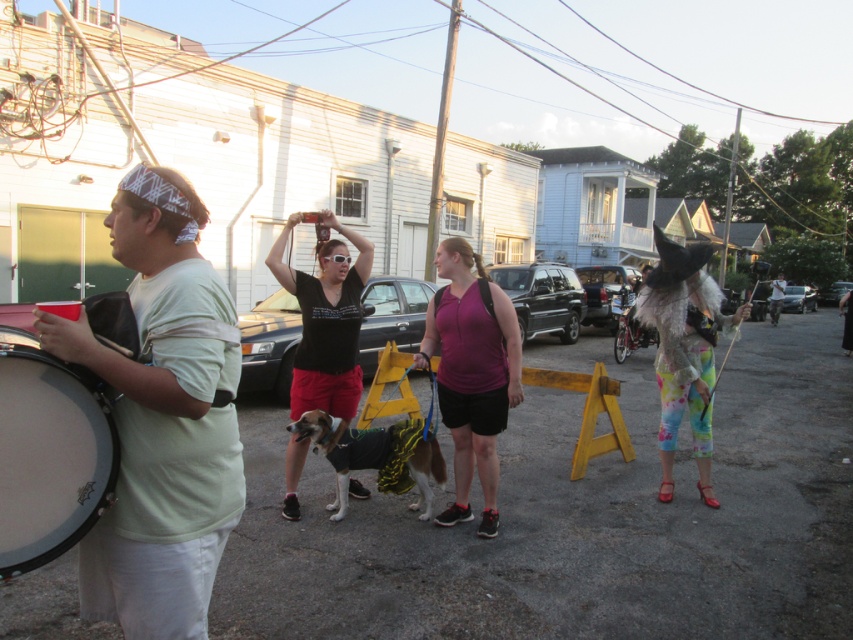
Who is more distant from viewer, [166,428] or [343,412]?

The point [343,412] is behind.

What do you see at coordinates (161, 419) in the screenshot? I see `matte white t-shirt at left` at bounding box center [161, 419].

This screenshot has height=640, width=853. Describe the element at coordinates (161, 419) in the screenshot. I see `matte white t-shirt at left` at that location.

The height and width of the screenshot is (640, 853). I want to click on matte white t-shirt at left, so click(x=161, y=419).

From the picture: How far apart are purple matte shirt at center and black matte t-shirt at center?

The distance of purple matte shirt at center from black matte t-shirt at center is 34.19 inches.

Can you confirm if purple matte shirt at center is taller than black matte t-shirt at center?

In fact, purple matte shirt at center may be shorter than black matte t-shirt at center.

Does point (496, 381) come closer to viewer compared to point (323, 337)?

That is True.

Image resolution: width=853 pixels, height=640 pixels. Find the location of `purple matte shirt at center`. purple matte shirt at center is located at coordinates (473, 372).

Is matte black drum at left wider than tie-dye fabric pants at right?

No, matte black drum at left is not wider than tie-dye fabric pants at right.

The width and height of the screenshot is (853, 640). Find the location of `matte black drum at left`. matte black drum at left is located at coordinates (49, 452).